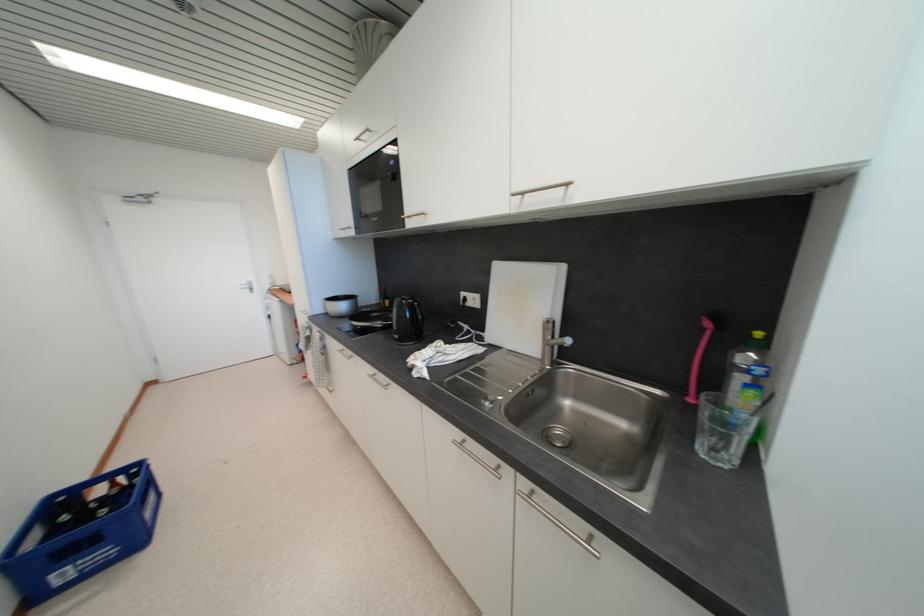
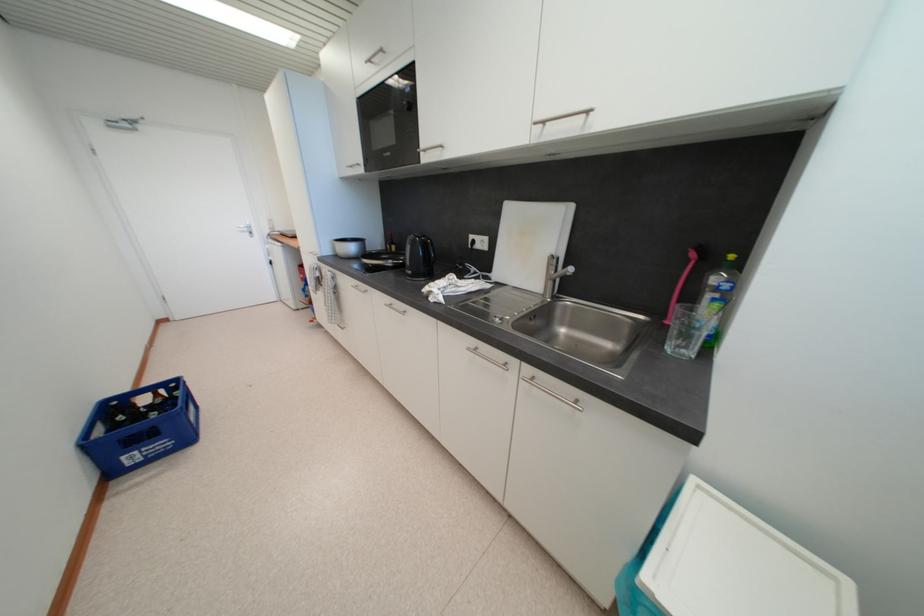
The point at (757,394) is marked in the first image. Where is the corresponding point in the second image?

(723, 307)